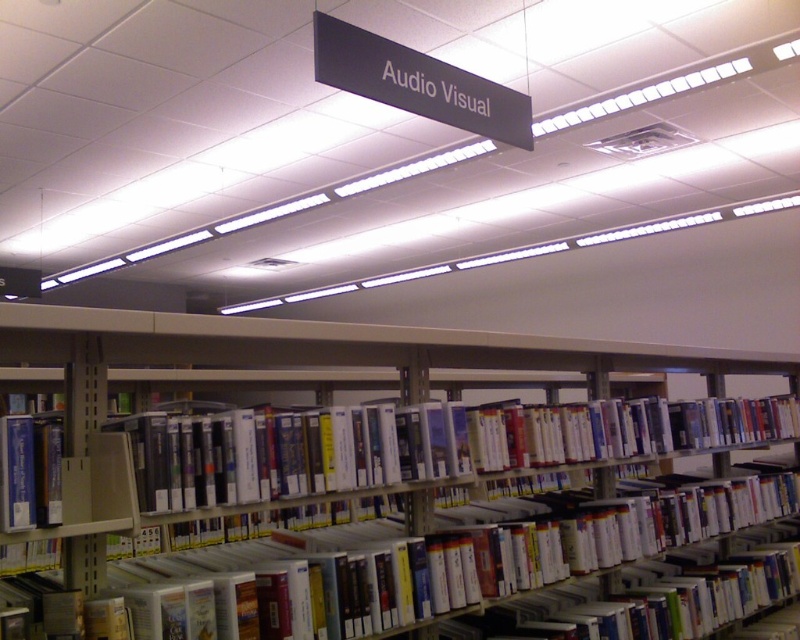
Can you confirm if metallic gray bookcase at center is smaller than blue hardcover book at left?

No.

Which is more to the left, metallic gray bookcase at center or blue hardcover book at left?

blue hardcover book at left is more to the left.

Who is more distant from viewer, (624, 416) or (56, 512)?

The point (624, 416) is more distant.

Identify the location of metallic gray bookcase at center. Image resolution: width=800 pixels, height=640 pixels. (374, 451).